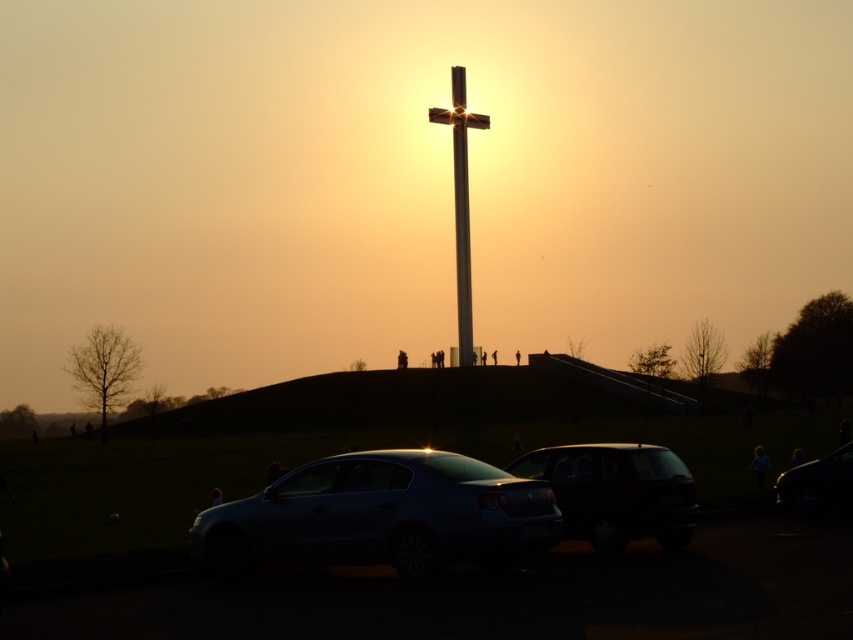
You are planning to park your car in the parking area shown in the image. You see a metallic gray car at lower center and a metallic silver sedan at center. Which parking spot would be more suitable for a compact car like yours?

The metallic silver sedan at center is narrower than the metallic gray car at lower center. Since your compact car is smaller, the parking spot for the metallic silver sedan at center would be more suitable as it requires less space.

You are standing at the point marked as point (x=503, y=595) in the image. What object is located at that point?

The point (x=503, y=595) corresponds to the metallic gray car at lower center.